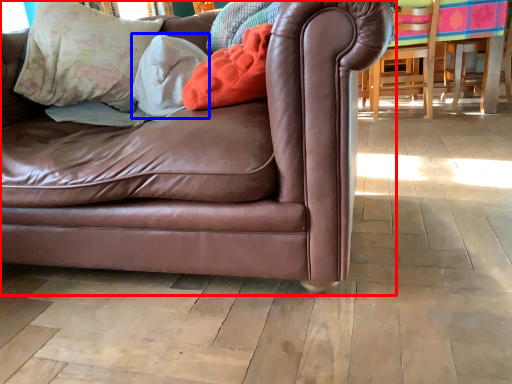
Question: Which point is closer to the camera, studio couch (highlighted by a red box) or pillow (highlighted by a blue box)?

Choices:
 (A) studio couch
 (B) pillow

Answer: (A)